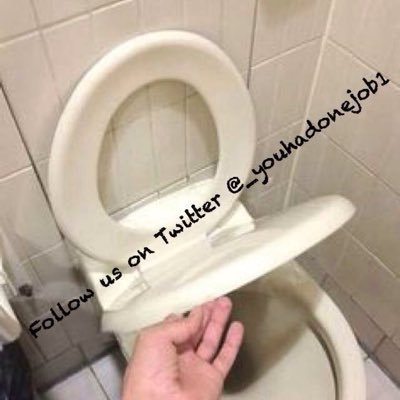
The height and width of the screenshot is (400, 400). I want to click on back of toilet, so click(174, 208).